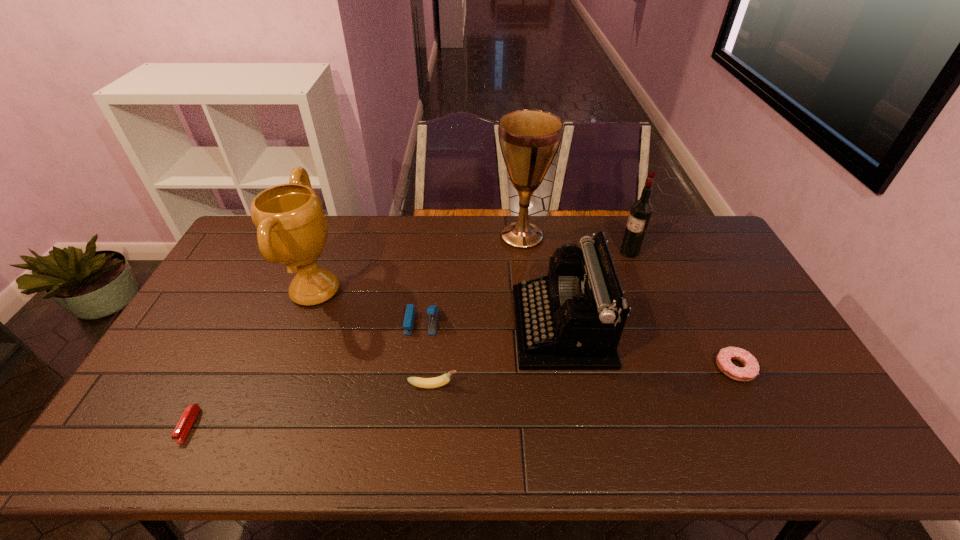
Image resolution: width=960 pixels, height=540 pixels. I want to click on vacant space located at the stem of the third shortest object, so click(593, 386).

In order to click on vacant region located on the right of the rightmost object in this screenshot , I will do click(773, 368).

You are a GUI agent. You are given a task and a screenshot of the screen. Output one action in this format:
    pyautogui.click(x=<x>, y=<y>)
    Task: Click on the trophy cup that is at the far edge
    Image resolution: width=960 pixels, height=540 pixels.
    Given the screenshot: What is the action you would take?
    pyautogui.click(x=529, y=139)

The width and height of the screenshot is (960, 540). I want to click on award located in the far edge section of the desktop, so click(x=291, y=226).

Image resolution: width=960 pixels, height=540 pixels. Find the location of `wine bottle located at the far edge`. wine bottle located at the far edge is located at coordinates pyautogui.click(x=640, y=213).

This screenshot has width=960, height=540. I want to click on object that is at the near edge, so click(189, 415).

Locate an element on the screen. This screenshot has height=540, width=960. object at the left edge is located at coordinates (189, 415).

The image size is (960, 540). Identify the location of object situated at the right edge. (750, 370).

Locate an element on the screen. The height and width of the screenshot is (540, 960). object positioned at the near left corner is located at coordinates (189, 415).

Locate an element on the screen. vacant space at the far edge of the desktop is located at coordinates (395, 232).